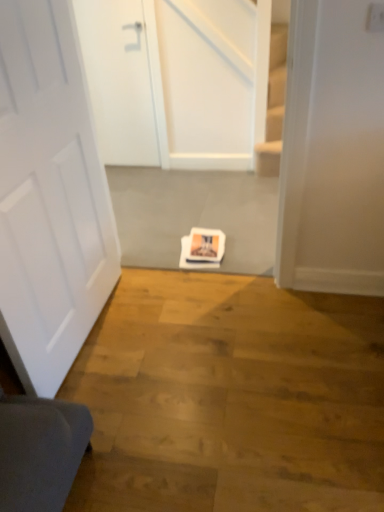
You are a GUI agent. You are given a task and a screenshot of the screen. Output one action in this format:
    pyautogui.click(x=<x>, y=<y>)
    Task: Click on the vacant area that is in front of white matte door at center, arranged as the first door when ordered from the bottom
    The height and width of the screenshot is (512, 384).
    Given the screenshot: What is the action you would take?
    pyautogui.click(x=117, y=403)